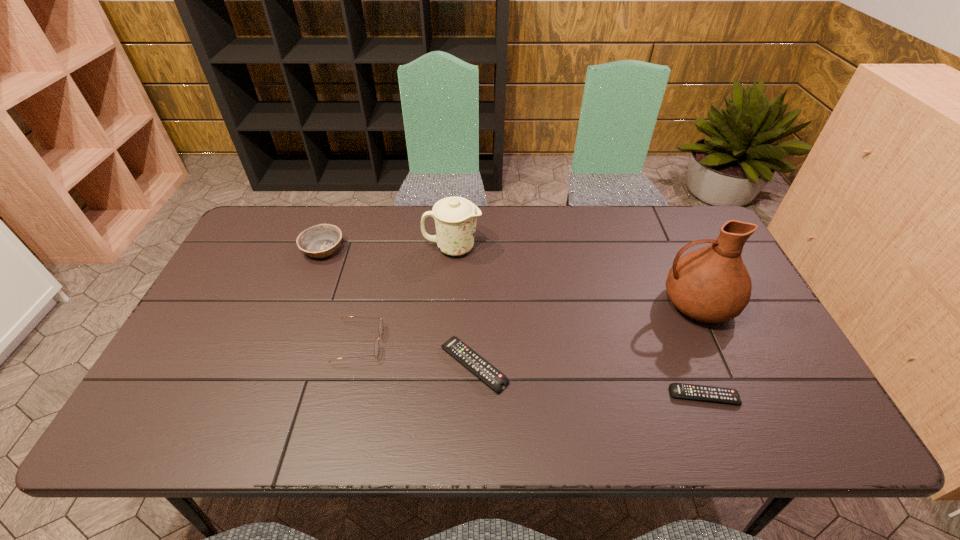
Where is `object located at the near right corner`? This screenshot has height=540, width=960. object located at the near right corner is located at coordinates (679, 390).

Locate an element on the screen. Image resolution: width=960 pixels, height=540 pixels. vacant area at the far edge is located at coordinates (374, 221).

Find the location of a particular element. The width and height of the screenshot is (960, 540). free spot at the near edge of the desktop is located at coordinates (365, 384).

The height and width of the screenshot is (540, 960). Identify the location of vacant region at the near left corner of the desktop. (161, 395).

This screenshot has height=540, width=960. I want to click on empty space between the fifth object from right to left and the fifth tallest object, so click(417, 354).

This screenshot has height=540, width=960. Find the location of `unoccupied area between the fifth object from right to left and the shorter remote control`. unoccupied area between the fifth object from right to left and the shorter remote control is located at coordinates (532, 369).

Where is `free spot between the right remote control and the fifth object from right to left`? This screenshot has height=540, width=960. free spot between the right remote control and the fifth object from right to left is located at coordinates 532,369.

Image resolution: width=960 pixels, height=540 pixels. I want to click on free space that is in between the shortest object and the bowl, so click(x=514, y=322).

Locate an element on the screen. The width and height of the screenshot is (960, 540). empty space between the leftmost object and the pitcher is located at coordinates (510, 276).

Identify the location of empty space between the leftmost object and the second object from left to right. (341, 296).